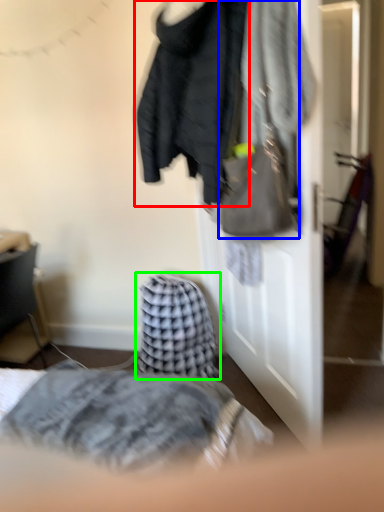
Question: Which object is positioned farthest from jacket (highlighted by a red box)? Select from handbag (highlighted by a blue box) and blanket (highlighted by a green box).

Choices:
 (A) handbag
 (B) blanket

Answer: (B)